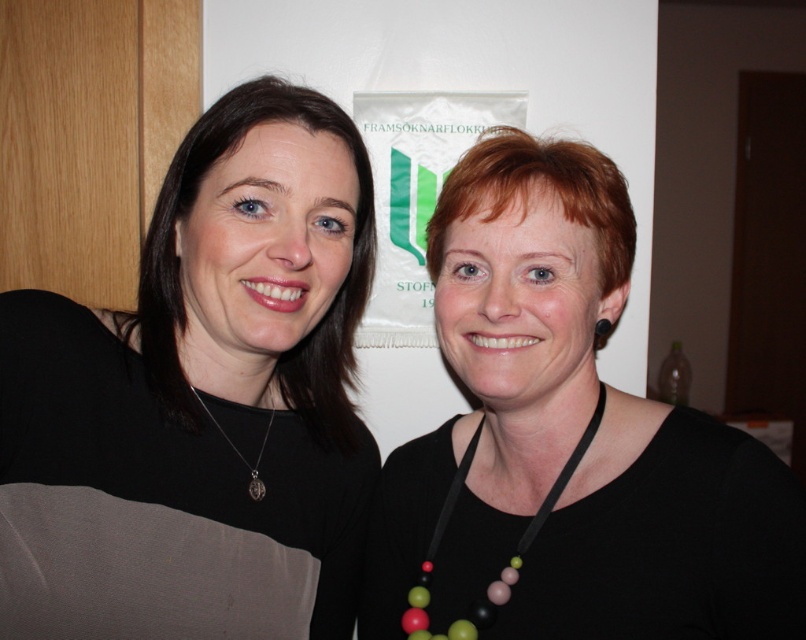
Question: Does black matte necklace at center have a smaller size compared to multicolored beads at center?

Choices:
 (A) no
 (B) yes

Answer: (A)

Question: Estimate the real-world distances between objects in this image. Which object is farther from the multicolored beads at center?

Choices:
 (A) silver metallic pendant at center
 (B) black matte necklace at upper left

Answer: (B)

Question: Which is farther from the black matte necklace at center?

Choices:
 (A) multicolored beads at center
 (B) silver metallic pendant at center

Answer: (B)

Question: Which object appears farthest from the camera in this image?

Choices:
 (A) black matte necklace at center
 (B) black matte necklace at upper left

Answer: (A)

Question: Is black matte necklace at center to the left of silver metallic pendant at center from the viewer's perspective?

Choices:
 (A) yes
 (B) no

Answer: (B)

Question: Observing the image, what is the correct spatial positioning of black matte necklace at upper left in reference to black matte necklace at center?

Choices:
 (A) below
 (B) above

Answer: (B)